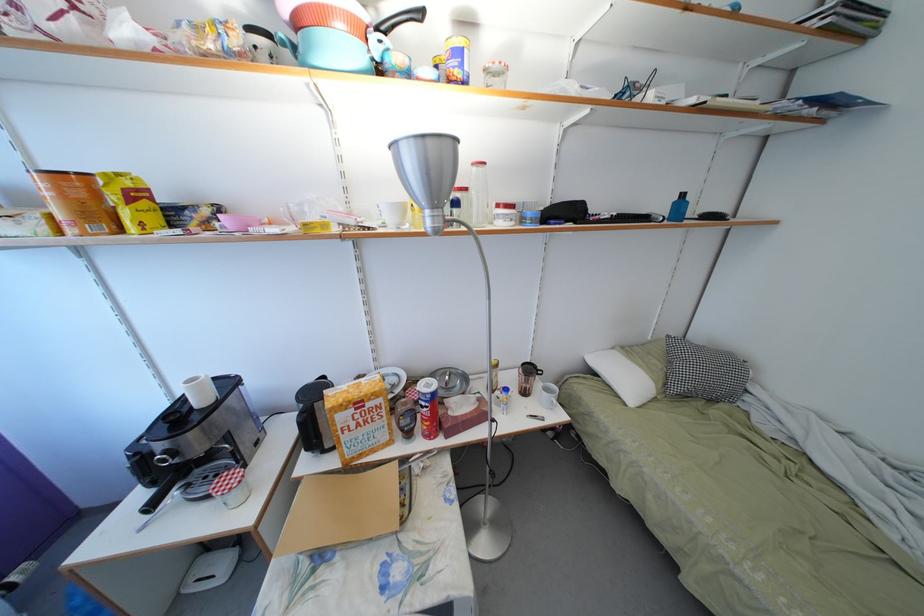
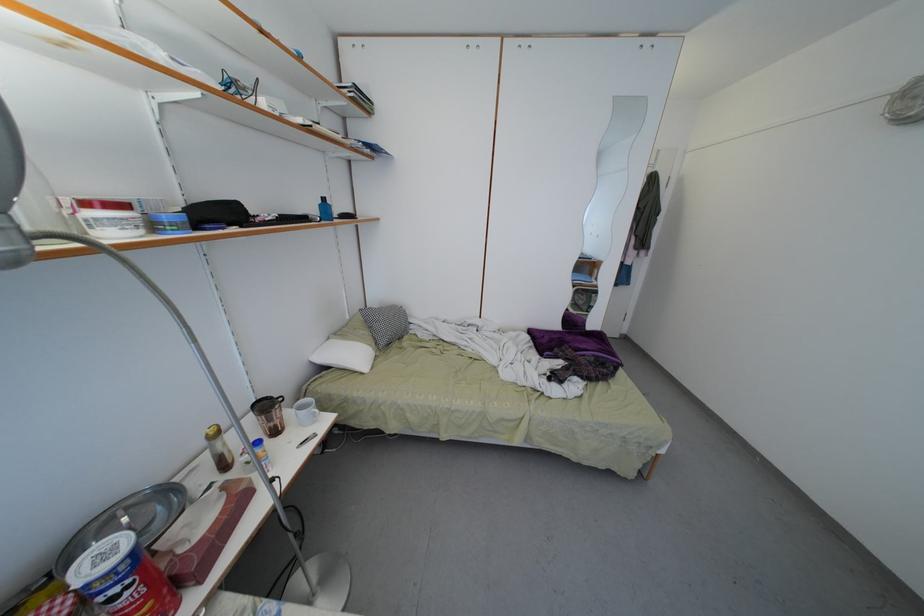
Question: The camera is either moving clockwise (left) or counter-clockwise (right) around the object. The first image is from the beginning of the video and the second image is from the end. Is the camera moving left or right when shooting the video?

Choices:
 (A) Left
 (B) Right

Answer: (A)